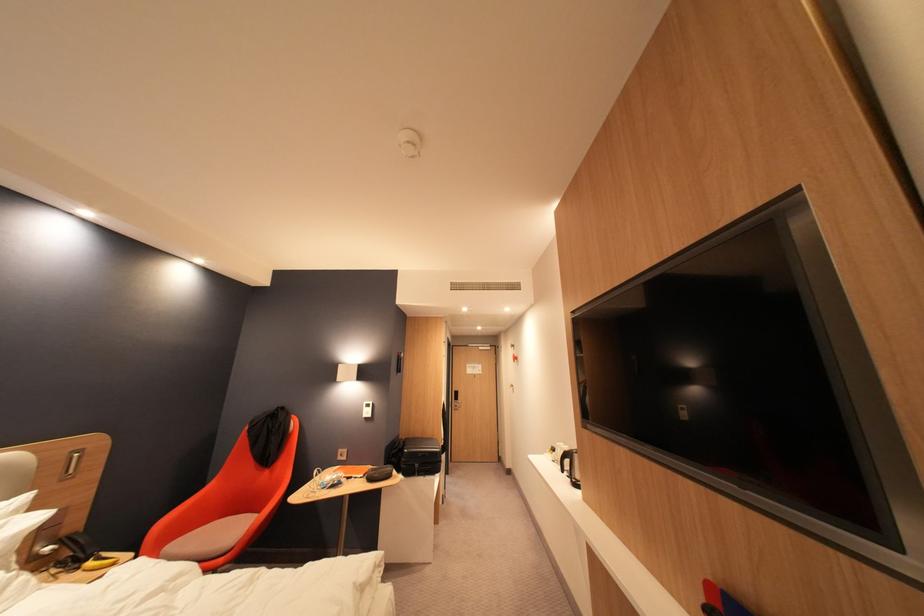
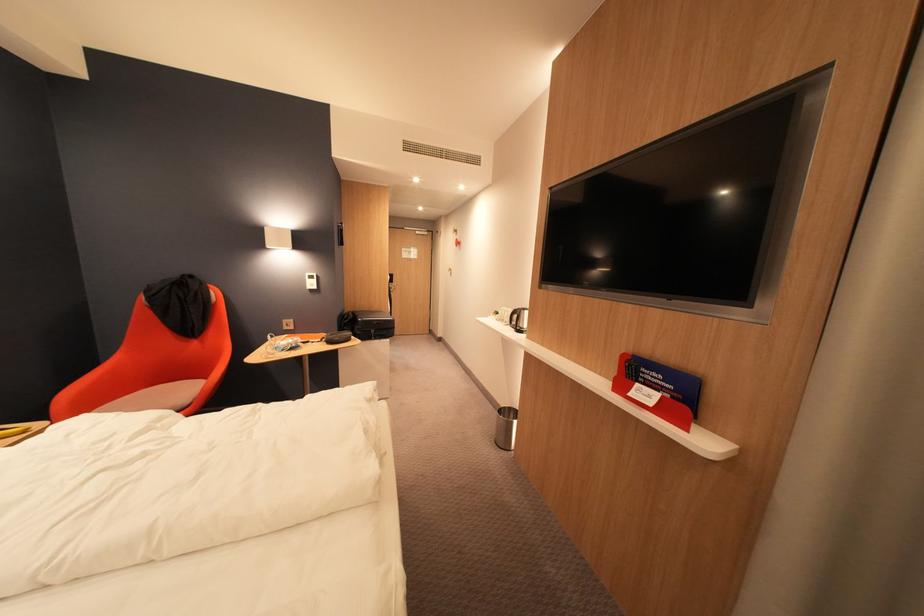
Find the pixel in the second image that matches pixel 416 453 in the first image.

(370, 321)